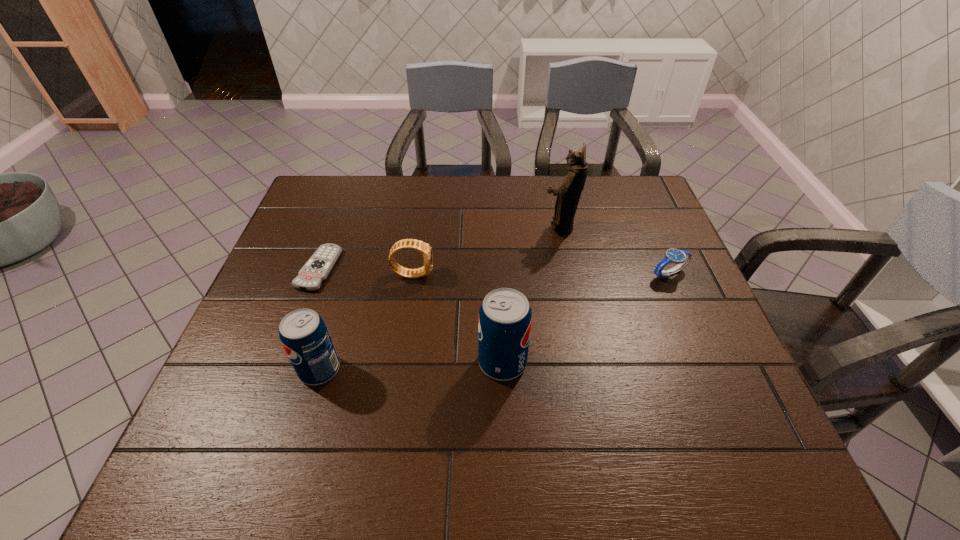
Locate an element on the screen. This screenshot has width=960, height=540. unoccupied area between the taller watch and the farthest object is located at coordinates (486, 251).

Image resolution: width=960 pixels, height=540 pixels. Identify the location of free area in between the shorter pop and the tallest object. (440, 299).

Identify the location of vacant space that's between the fourth shortest object and the second object from right to left. (440, 299).

Locate an element on the screen. This screenshot has width=960, height=540. free area in between the left pop and the taller pop is located at coordinates (411, 366).

The image size is (960, 540). I want to click on unoccupied position between the taller watch and the remote control, so click(x=366, y=271).

Point out which object is positioned as the fourth nearest to the shorter pop. Please provide its 2D coordinates. Your answer should be formatted as a tuple, i.e. [(x, y)], where the tuple contains the x and y coordinates of a point satisfying the conditions above.

[(568, 194)]

Locate an element on the screen. The height and width of the screenshot is (540, 960). object that stands as the second closest to the shortest object is located at coordinates (305, 338).

Where is `free region that satisfies the following two spatial constraints: 1. on the back side of the rightmost object; 2. on the front-facing side of the tallest object`? This screenshot has width=960, height=540. free region that satisfies the following two spatial constraints: 1. on the back side of the rightmost object; 2. on the front-facing side of the tallest object is located at coordinates (649, 228).

At what (x,y) coordinates should I click in order to perform the action: click on vacant area in the image that satisfies the following two spatial constraints: 1. on the back side of the second shortest object; 2. on the face of the fourth tallest object. Please return your answer as a coordinate pair (x, y). Image resolution: width=960 pixels, height=540 pixels. Looking at the image, I should click on (669, 274).

Image resolution: width=960 pixels, height=540 pixels. Find the location of `free point that satisfies the following two spatial constraints: 1. on the front-facing side of the rightmost object; 2. on the left side of the figurine`. free point that satisfies the following two spatial constraints: 1. on the front-facing side of the rightmost object; 2. on the left side of the figurine is located at coordinates (568, 274).